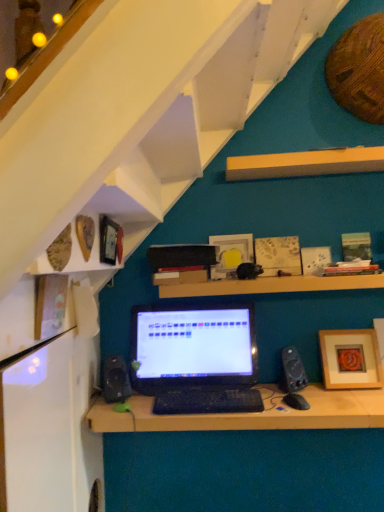
I want to click on free space in front of wooden picture frame at lower right, positioned as the 1th picture frame in right-to-left order, so (357, 404).